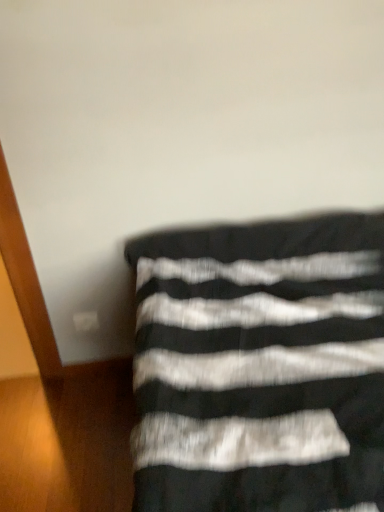
Find the location of a particular element. black striped fabric at lower right is located at coordinates (x=260, y=366).

Describe the element at coordinates (260, 366) in the screenshot. I see `black striped fabric at lower right` at that location.

Where is `black striped fabric at lower right`? The image size is (384, 512). black striped fabric at lower right is located at coordinates (260, 366).